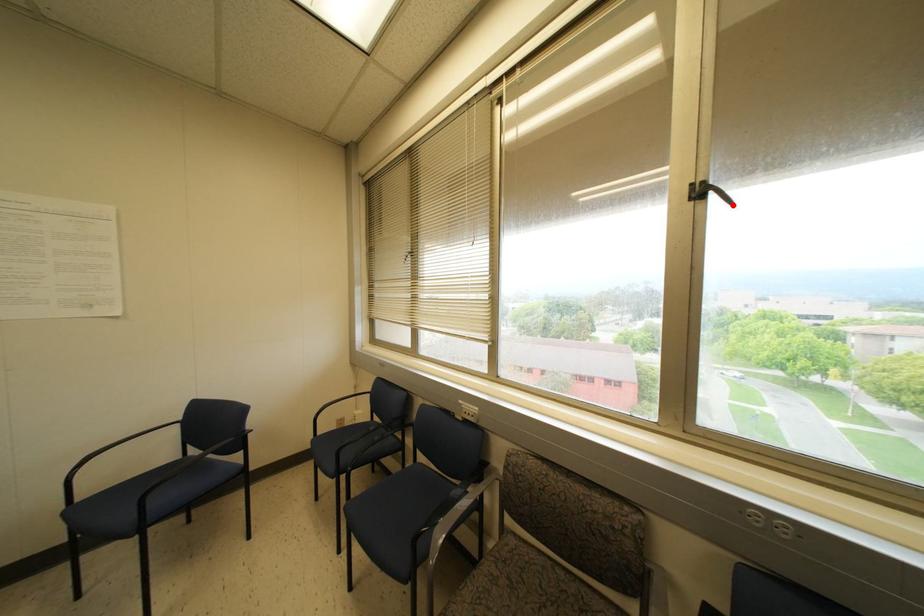
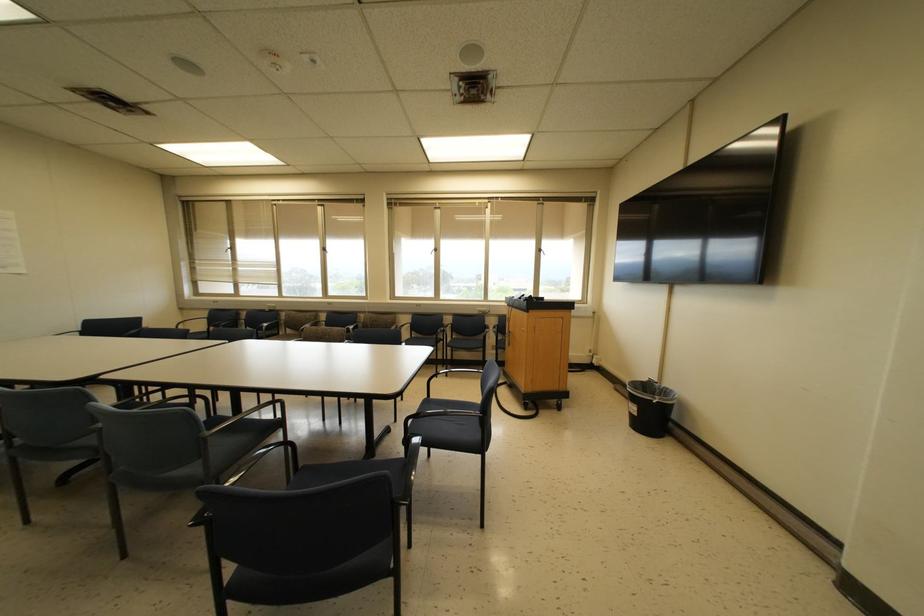
Question: I am providing you with two images of the same scene from different viewpoints. Image1 has a red point marked. In image2, the corresponding 3D location appears at what relative position? Reply with the corresponding letter.

Choices:
 (A) Closer
 (B) Farther

Answer: (A)